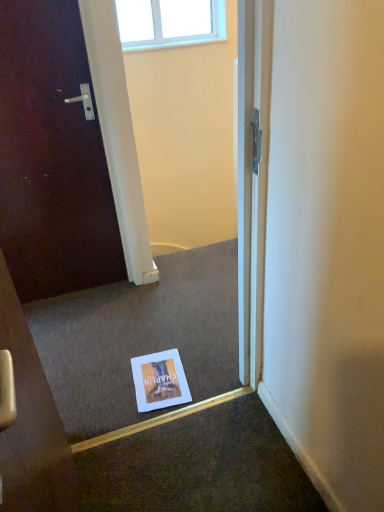
This screenshot has width=384, height=512. I want to click on vacant space to the left of white paper flyer at center, so click(x=109, y=388).